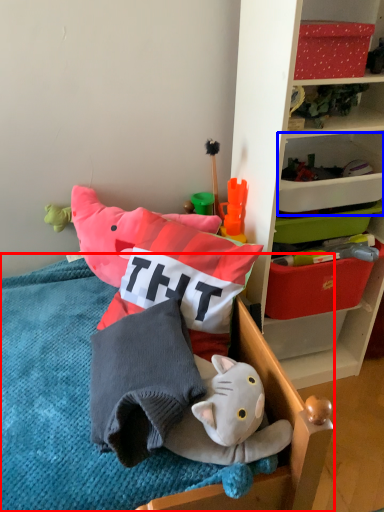
Question: Among these objects, which one is farthest to the camera, furniture (highlighted by a red box) or storage box (highlighted by a blue box)?

Choices:
 (A) furniture
 (B) storage box

Answer: (B)